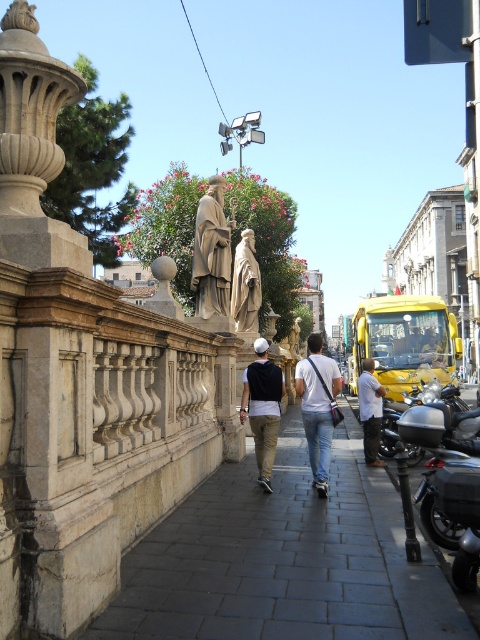
Who is positioned more to the right, matte stone statue at center or golden polished statue at center?

Positioned to the right is golden polished statue at center.

Does matte stone statue at center appear under golden polished statue at center?

No.

Where is `matte stone statue at center`? The height and width of the screenshot is (640, 480). matte stone statue at center is located at coordinates (212, 252).

Locate an element on the screen. The image size is (480, 640). matte stone statue at center is located at coordinates (212, 252).

Who is positioned more to the right, polished bronze statue at center or golden polished statue at center?

Positioned to the right is golden polished statue at center.

Does polished bronze statue at center have a greater width compared to golden polished statue at center?

No, polished bronze statue at center is not wider than golden polished statue at center.

What do you see at coordinates (245, 284) in the screenshot? The image size is (480, 640). I see `polished bronze statue at center` at bounding box center [245, 284].

Identify the location of polished bronze statue at center. (245, 284).

Which is more to the right, white fabric shirt at center or golden polished statue at center?

golden polished statue at center

Is white fabric shirt at center wider than golden polished statue at center?

No, white fabric shirt at center is not wider than golden polished statue at center.

This screenshot has width=480, height=640. What are the coordinates of `white fabric shirt at center` in the screenshot? It's located at (317, 406).

At what (x,y) coordinates should I click in order to perform the action: click on white fabric shirt at center. Please return your answer as a coordinate pair (x, y). This screenshot has width=480, height=640. Looking at the image, I should click on (317, 406).